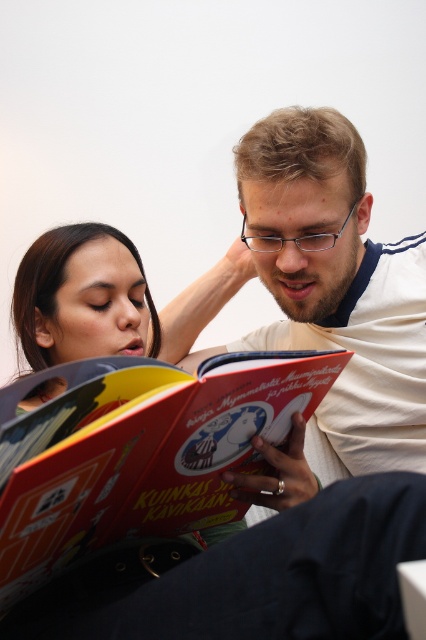
You are standing in front of the scene and want to know which of the two points, point (331,176) or point (63,404), is closer to you. Can you determine this based on their positions?

Point (331,176) is further to the viewer than point (63,404), so the closer point to you is point (63,404).

What is the color of the shirt at the position marked by point (322, 291)?

The point (322, 291) marks the matte white shirt at center.